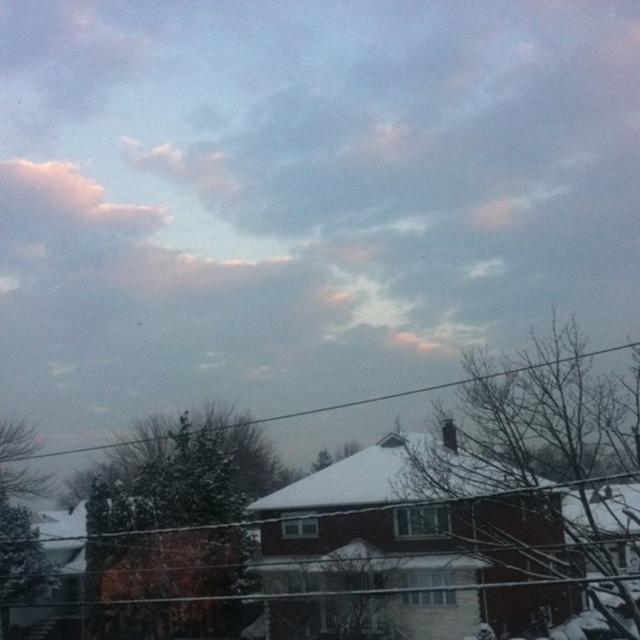
You are standing in a field looking at the puffy white cloud at upper left. If you walk 200 feet straight towards it, will you be able to see the cloud anymore?

The puffy white cloud at upper left is 308.41 feet away from you. If you walk 200 feet towards it, you will still be 108.41 feet away, so yes, you will still be able to see the puffy white cloud at upper left.

You are an artist trying to paint the winter scene. You notice the puffy white cloud at upper left and the black wire at upper center. Which object should you paint first to ensure proper layering?

You should paint the black wire at upper center first because the puffy white cloud at upper left occupies less space and might be partially hidden by the wire if painted afterward.

You are an observer looking at the winter scene. You notice the puffy white cloud at upper left and the black wire at upper center. Which object is positioned to the left of the other?

The puffy white cloud at upper left is to the left of the black wire at upper center.